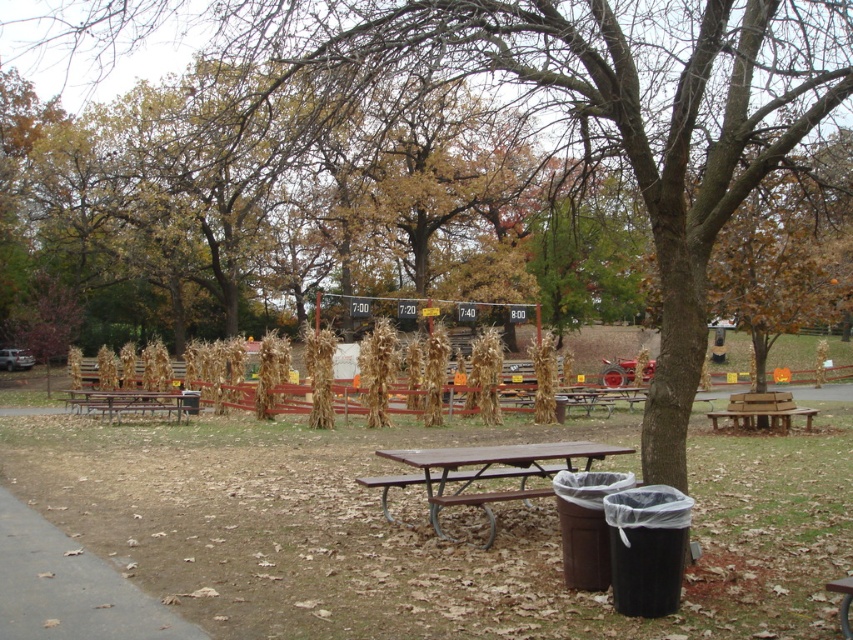
You are a parent trying to choose between two picnic tables for your child to sit on. The brown metal picnic table at center and the brown wooden picnic table at lower left are both available. Which one is taller and might be more comfortable for an older child?

The brown metal picnic table at center is taller than the brown wooden picnic table at lower left, making it more suitable for an older child who might prefer a higher seat.